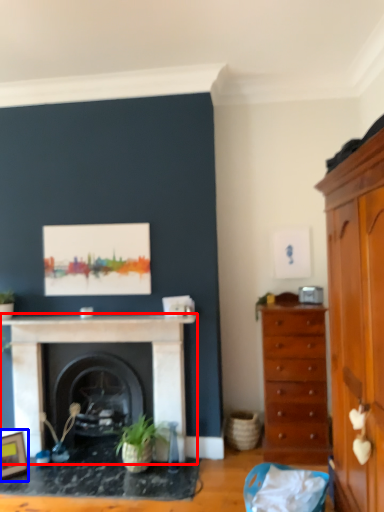
Question: Which object is closer to the camera taking this photo, fireplace (highlighted by a red box) or picture frame (highlighted by a blue box)?

Choices:
 (A) fireplace
 (B) picture frame

Answer: (B)